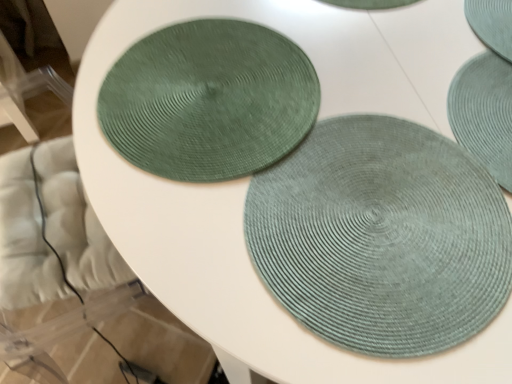
Question: Considering the positions of sage green woven mat at center, positioned as the 1th mat in back-to-front order, and teal woven coaster at upper right, positioned as the 2th coaster in left-to-right order, in the image, is sage green woven mat at center, positioned as the 1th mat in back-to-front order, bigger or smaller than teal woven coaster at upper right, positioned as the 2th coaster in left-to-right order,?

Choices:
 (A) big
 (B) small

Answer: (B)

Question: Considering the positions of sage green woven mat at center, positioned as the 1th mat in back-to-front order, and teal woven coaster at upper right, positioned as the 2th coaster in left-to-right order, in the image, is sage green woven mat at center, positioned as the 1th mat in back-to-front order, taller or shorter than teal woven coaster at upper right, positioned as the 2th coaster in left-to-right order,?

Choices:
 (A) tall
 (B) short

Answer: (B)

Question: Which is farther from the sage green woven mat at center, placed as the second mat when sorted from back to front?

Choices:
 (A) sage green woven mat at center, positioned as the 1th mat in back-to-front order
 (B) green woven coaster at upper left, the 1th coaster when ordered from left to right
 (C) teal woven coaster at upper right, the first coaster when ordered from right to left

Answer: (C)

Question: Considering the real-world distances, which object is closest to the green woven coaster at upper left, the 1th coaster when ordered from left to right?

Choices:
 (A) sage green woven mat at center, placed as the second mat when sorted from front to back
 (B) sage green woven mat at center, arranged as the 1th mat when viewed from the front
 (C) teal woven coaster at upper right, the first coaster when ordered from right to left

Answer: (B)